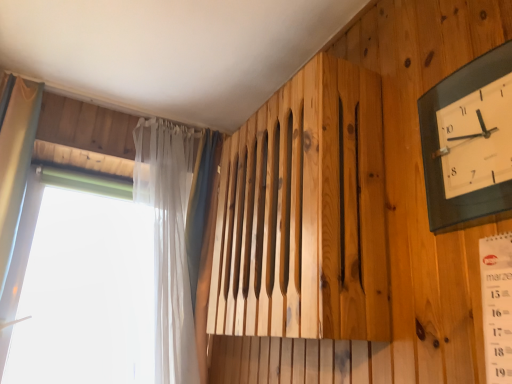
In order to face black glass wall clock at upper right, should I rotate leftwards or rightwards?

Turn right approximately 26.468 degrees to face it.

The width and height of the screenshot is (512, 384). Describe the element at coordinates (15, 161) in the screenshot. I see `translucent fabric curtain at left` at that location.

Find the location of a particular element. This screenshot has height=384, width=512. transparent plastic window at left is located at coordinates (169, 235).

Consider the image. From a real-world perspective, is transparent plastic window at left physically above black glass wall clock at upper right?

No, from a real-world perspective, transparent plastic window at left is not over black glass wall clock at upper right

Considering the positions of objects transparent plastic window at left and black glass wall clock at upper right in the image provided, who is in front, transparent plastic window at left or black glass wall clock at upper right?

Positioned in front is black glass wall clock at upper right.

The width and height of the screenshot is (512, 384). Find the location of `wall clock that is in front of the transparent plastic window at left`. wall clock that is in front of the transparent plastic window at left is located at coordinates (439, 145).

What's the angular difference between transparent plastic window at left and black glass wall clock at upper right's facing directions?

The angle between the facing direction of transparent plastic window at left and the facing direction of black glass wall clock at upper right is 88.9 degrees.

Is point (506, 189) closer to camera compared to point (0, 270)?

Yes, it is.

From the image's perspective, which is above, black glass wall clock at upper right or translucent fabric curtain at left?

black glass wall clock at upper right appears higher in the image.

Between black glass wall clock at upper right and translucent fabric curtain at left, which one is positioned in front?

black glass wall clock at upper right is more forward.

Is black glass wall clock at upper right far away from translucent fabric curtain at left?

Yes, black glass wall clock at upper right and translucent fabric curtain at left are located far from each other.

Based on their sizes in the image, would you say translucent fabric curtain at left is bigger or smaller than black glass wall clock at upper right?

Clearly, translucent fabric curtain at left is larger in size than black glass wall clock at upper right.

Considering the sizes of objects translucent fabric curtain at left and black glass wall clock at upper right in the image provided, who is shorter, translucent fabric curtain at left or black glass wall clock at upper right?

With less height is black glass wall clock at upper right.

From a real-world perspective, relative to black glass wall clock at upper right, is translucent fabric curtain at left vertically above or below?

From a real-world perspective, translucent fabric curtain at left is physically above black glass wall clock at upper right.

Can you confirm if transparent plastic window at left is bigger than translucent fabric curtain at left?

Yes.

This screenshot has height=384, width=512. What are the coordinates of `curtain on the left of transparent plastic window at left` in the screenshot? It's located at pyautogui.click(x=15, y=161).

Between point (166, 125) and point (25, 160), which one is positioned behind?

The point (166, 125) is behind.

Relative to transparent plastic window at left, is translucent fabric curtain at left in front or behind?

translucent fabric curtain at left is positioned closer to the viewer than transparent plastic window at left.

Does translucent fabric curtain at left have a greater height compared to transparent plastic window at left?

Correct, translucent fabric curtain at left is much taller as transparent plastic window at left.

In terms of size, does translucent fabric curtain at left appear bigger or smaller than transparent plastic window at left?

Clearly, translucent fabric curtain at left is smaller in size than transparent plastic window at left.

Based on the photo, is translucent fabric curtain at left wider than transparent plastic window at left?

Yes.

Is black glass wall clock at upper right positioned beyond the bounds of transparent plastic window at left?

Indeed, black glass wall clock at upper right is completely outside transparent plastic window at left.

Does black glass wall clock at upper right have a larger size compared to transparent plastic window at left?

No, black glass wall clock at upper right is not bigger than transparent plastic window at left.

Can you tell me how much black glass wall clock at upper right and transparent plastic window at left differ in facing direction?

The angular difference between black glass wall clock at upper right and transparent plastic window at left is 88.9 degrees.

Which object is thinner, black glass wall clock at upper right or transparent plastic window at left?

black glass wall clock at upper right is thinner.

I want to click on window lying on the left of black glass wall clock at upper right, so click(x=169, y=235).

The width and height of the screenshot is (512, 384). I want to click on curtain above the black glass wall clock at upper right (from a real-world perspective), so click(15, 161).

Estimate the real-world distances between objects in this image. Which object is further from translucent fabric curtain at left, transparent plastic window at left or black glass wall clock at upper right?

black glass wall clock at upper right is further to translucent fabric curtain at left.

Based on their spatial positions, is translucent fabric curtain at left or transparent plastic window at left further from black glass wall clock at upper right?

Among the two, translucent fabric curtain at left is located further to black glass wall clock at upper right.

From the image, which object appears to be nearer to transparent plastic window at left, translucent fabric curtain at left or black glass wall clock at upper right?

Among the two, translucent fabric curtain at left is located nearer to transparent plastic window at left.

Based on their spatial positions, is transparent plastic window at left or translucent fabric curtain at left further from black glass wall clock at upper right?

The object further to black glass wall clock at upper right is translucent fabric curtain at left.

Estimate the real-world distances between objects in this image. Which object is closer to translucent fabric curtain at left, black glass wall clock at upper right or transparent plastic window at left?

The object closer to translucent fabric curtain at left is transparent plastic window at left.

From the image, which object appears to be nearer to transparent plastic window at left, black glass wall clock at upper right or translucent fabric curtain at left?

translucent fabric curtain at left lies closer to transparent plastic window at left than the other object.

Find the location of `window located between translucent fabric curtain at left and black glass wall clock at upper right in the left-right direction`. window located between translucent fabric curtain at left and black glass wall clock at upper right in the left-right direction is located at coordinates (169, 235).